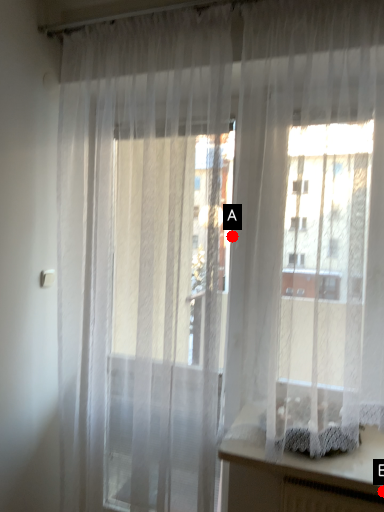
Question: Two points are circled on the image, labeled by A and B beside each circle. Which point is closer to the camera?

Choices:
 (A) A is closer
 (B) B is closer

Answer: (B)